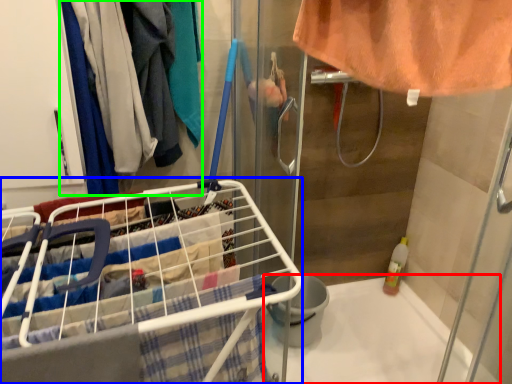
Question: Which object is the farthest from bath (highlighted by a red box)? Choose among these: shopping cart (highlighted by a blue box) or clothing (highlighted by a green box).

Choices:
 (A) shopping cart
 (B) clothing

Answer: (B)